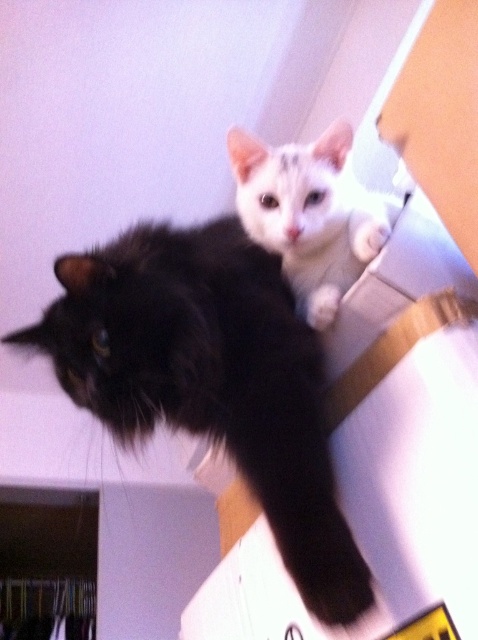
You are a photographer trying to capture a closeup of the white soft fur cat at upper center. Based on the coordinates provided, where should you position your camera relative to the black cat lying on the white cardboard box?

The white soft fur cat at upper center is located at point (304, 205), so you should position your camera slightly to the right and above the black cat lying on the white cardboard box to capture the closeup.

You are a photographer trying to capture a clear shot of both the white soft fur cat at upper center and the white fur at upper center. Which one is positioned higher in the image?

The white soft fur cat at upper center is positioned higher than the white fur at upper center.